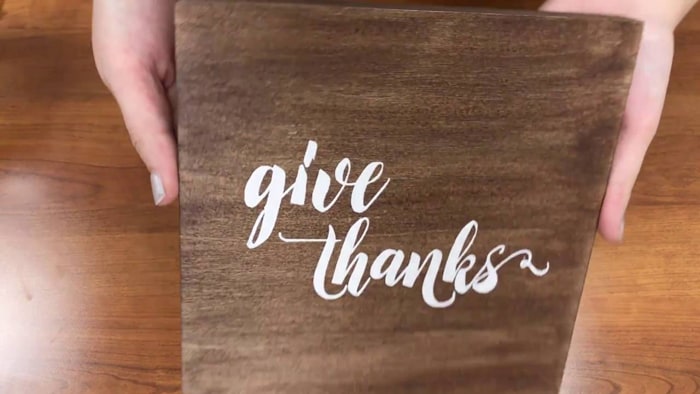
Identify the location of reflection of white on wooden tabletop. (29, 305), (572, 371).